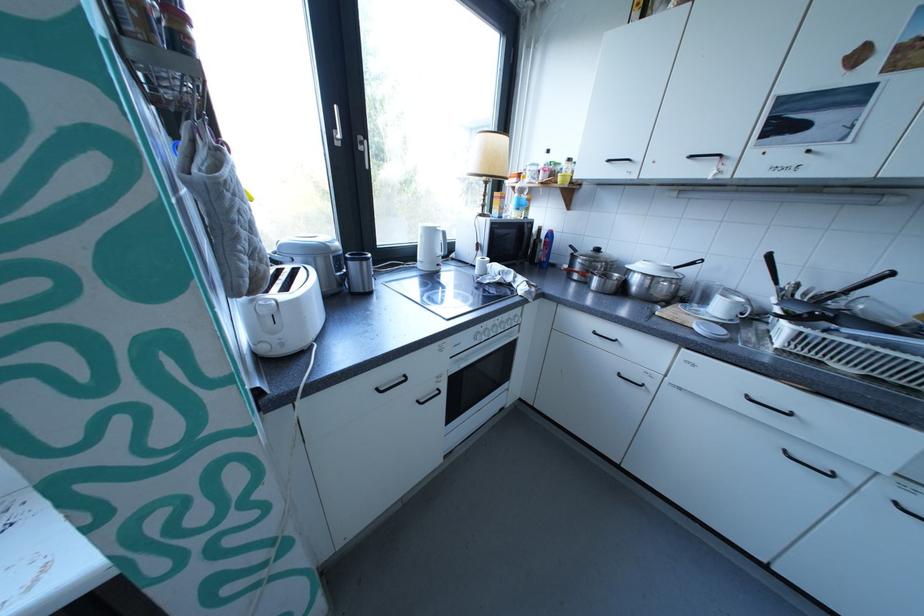
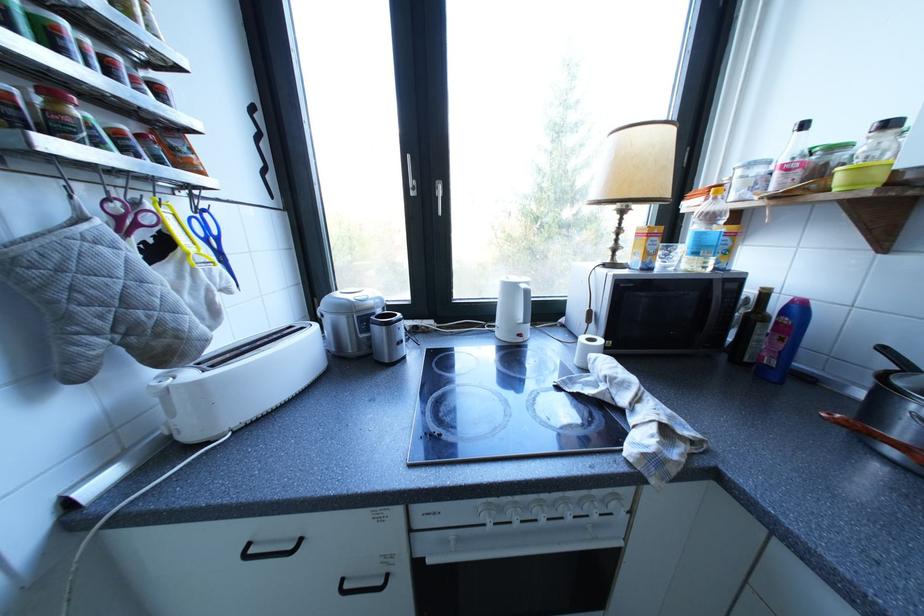
Question: I am providing you with two images of the same scene from different viewpoints. Which of the following objects are not visible in image2?

Choices:
 (A) microwave door handle
 (B) grey oven mitt
 (C) white oven knob
 (D) none of these

Answer: (D)